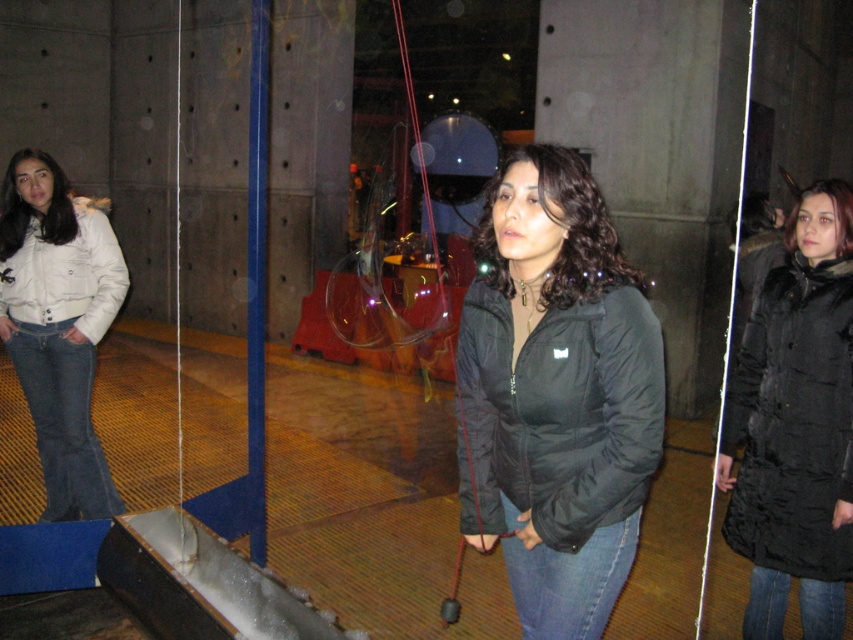
Does black puffy coat at right have a greater height compared to white cotton jacket at left?

In fact, black puffy coat at right may be shorter than white cotton jacket at left.

What are the coordinates of `black puffy coat at right` in the screenshot? It's located at (793, 422).

Does black puffy coat at right lie in front of matte black jacket at left?

That is True.

Is black puffy coat at right thinner than matte black jacket at left?

Yes, black puffy coat at right is thinner than matte black jacket at left.

Identify the location of black puffy coat at right. The image size is (853, 640). (793, 422).

You are a GUI agent. You are given a task and a screenshot of the screen. Output one action in this format:
    pyautogui.click(x=<x>, y=<y>)
    Task: Click on the black puffy coat at right
    
    Given the screenshot: What is the action you would take?
    pyautogui.click(x=793, y=422)

Can you confirm if black puffy coat at right is taller than transparent glass at lower center?

Yes.

Find the location of a particular element. black puffy coat at right is located at coordinates (793, 422).